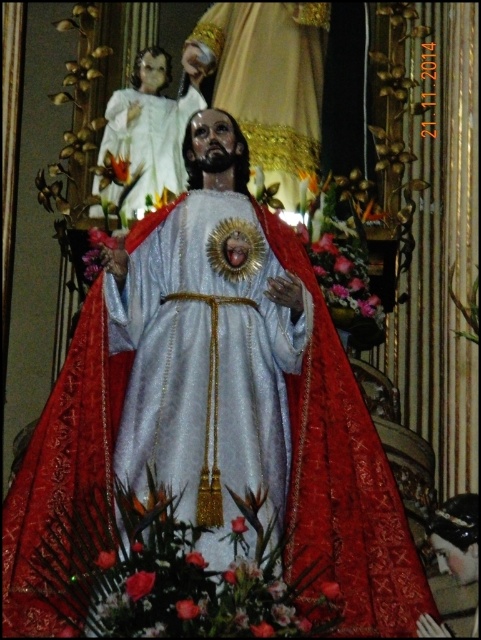
Is point (226, 164) closer to viewer compared to point (139, 163)?

That is True.

Is point (140, 296) positioned after point (155, 180)?

No, it is in front of (155, 180).

Is point (255, 326) closer to viewer compared to point (166, 109)?

Yes, point (255, 326) is in front of point (166, 109).

Locate an element on the screen. Image resolution: width=481 pixels, height=640 pixels. shiny silver statue at center is located at coordinates (207, 342).